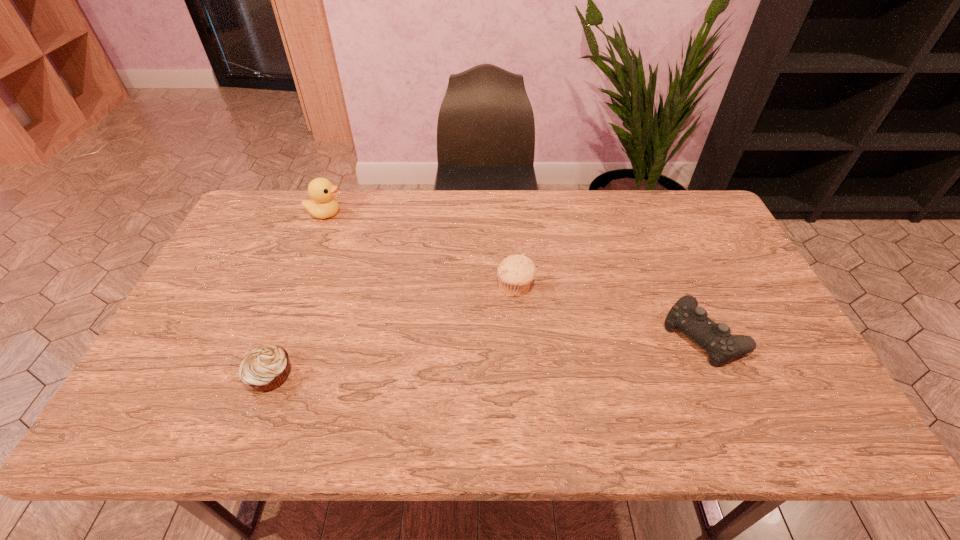
Locate an element on the screen. The image size is (960, 540). vacant space in between the control and the third shortest object is located at coordinates (610, 310).

Find the location of a particular element. free space between the rightmost object and the nearer muffin is located at coordinates (488, 355).

Locate an element on the screen. Image resolution: width=960 pixels, height=540 pixels. vacant point located between the third nearest object and the tallest object is located at coordinates (420, 251).

Where is `vacant space that is in between the duck and the right muffin`? The width and height of the screenshot is (960, 540). vacant space that is in between the duck and the right muffin is located at coordinates (420, 251).

What are the coordinates of `unoccupied position between the right muffin and the shorter muffin` in the screenshot? It's located at (394, 332).

You are a GUI agent. You are given a task and a screenshot of the screen. Output one action in this format:
    pyautogui.click(x=<x>, y=<y>)
    Task: Click on the free point between the duck and the farther muffin
    The width and height of the screenshot is (960, 540).
    Given the screenshot: What is the action you would take?
    pyautogui.click(x=420, y=251)

Locate an element on the screen. vacant area that lies between the duck and the left muffin is located at coordinates (299, 295).

I want to click on object that is the closest to the farthest object, so click(x=265, y=368).

In order to click on object that stands as the closest to the second farthest object in this screenshot , I will do `click(715, 338)`.

This screenshot has width=960, height=540. I want to click on free location that satisfies the following two spatial constraints: 1. on the face of the duck; 2. on the back side of the left muffin, so click(x=261, y=376).